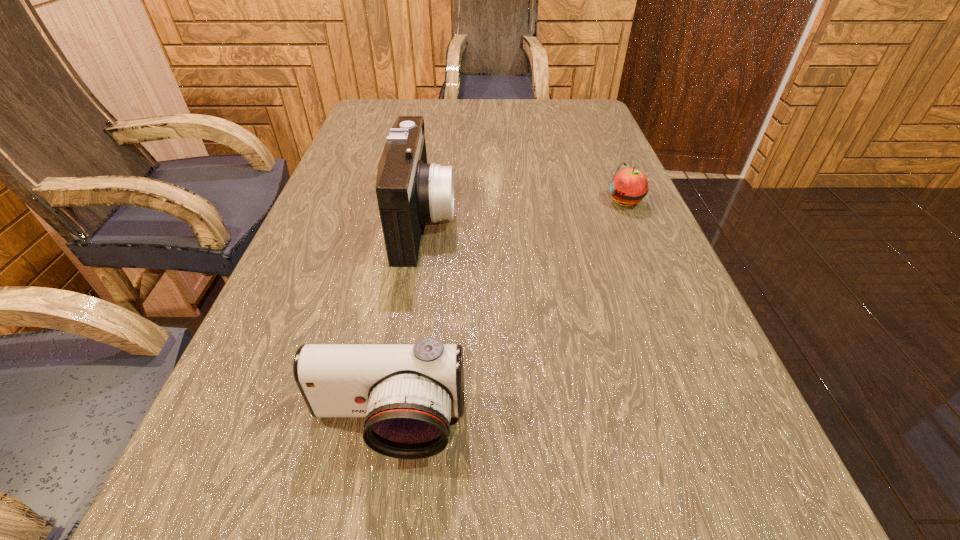
Locate an element on the screen. vacant space that is in between the apple and the farther camcorder is located at coordinates (524, 211).

Identify the location of empty space between the apple and the taller camcorder. The image size is (960, 540). (524, 211).

I want to click on free space between the second tallest object and the tallest object, so click(x=406, y=323).

This screenshot has height=540, width=960. What are the coordinates of `unoccupied area between the shortest object and the tallest object` in the screenshot? It's located at (524, 211).

You are a GUI agent. You are given a task and a screenshot of the screen. Output one action in this format:
    pyautogui.click(x=<x>, y=<y>)
    Task: Click on the unoccupied position between the rightmost object and the shorter camcorder
    
    Given the screenshot: What is the action you would take?
    pyautogui.click(x=507, y=313)

Identify the location of object that stands as the second closest to the farther camcorder. pyautogui.click(x=629, y=186).

Where is `the second closest object to the rightmost object`? This screenshot has height=540, width=960. the second closest object to the rightmost object is located at coordinates (407, 393).

This screenshot has height=540, width=960. I want to click on vacant region that satisfies the following two spatial constraints: 1. on the lens of the farther camcorder; 2. on the surface of the shorter camcorder, so click(x=391, y=426).

I want to click on free space that satisfies the following two spatial constraints: 1. on the lens of the tallest object; 2. on the surface of the second tallest object, so click(391, 426).

You are a GUI agent. You are given a task and a screenshot of the screen. Output one action in this format:
    pyautogui.click(x=<x>, y=<y>)
    Task: Click on the free region that satisfies the following two spatial constraints: 1. on the lens of the tallest object; 2. on the surface of the second shortest object
    
    Given the screenshot: What is the action you would take?
    pyautogui.click(x=391, y=426)